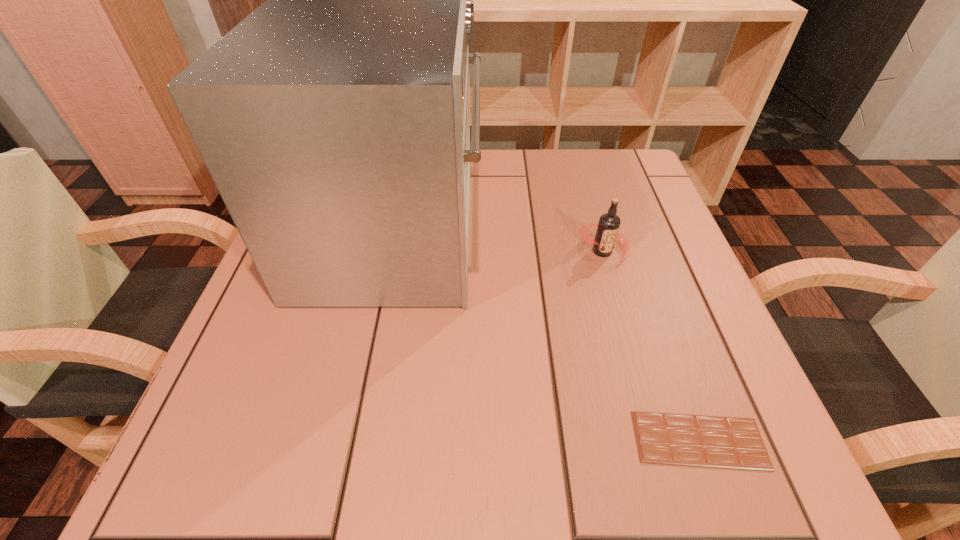
The image size is (960, 540). I want to click on free space between the root beer and the tallest object, so click(x=498, y=243).

Where is `free spot between the nearest object and the toaster oven`? The image size is (960, 540). free spot between the nearest object and the toaster oven is located at coordinates (546, 338).

The height and width of the screenshot is (540, 960). In order to click on vacant space that's between the shortest object and the root beer in this screenshot , I will do `click(651, 346)`.

You are a GUI agent. You are given a task and a screenshot of the screen. Output one action in this format:
    pyautogui.click(x=<x>, y=<y>)
    Task: Click on the empty location between the root beer and the leftmost object
    
    Given the screenshot: What is the action you would take?
    pyautogui.click(x=498, y=243)

Locate an element on the screen. vacant space that is in between the root beer and the nearest object is located at coordinates (651, 346).

In order to click on vacant space in between the tallest object and the second tallest object in this screenshot , I will do [498, 243].

At what (x,y) coordinates should I click in order to perform the action: click on vacant area that lies between the shortest object and the tallest object. Please return your answer as a coordinate pair (x, y). Looking at the image, I should click on (546, 338).

Find the location of a particular element. The height and width of the screenshot is (540, 960). vacant point located between the toaster oven and the second shortest object is located at coordinates (498, 243).

Where is `vacant point located between the nearest object and the tallest object`? vacant point located between the nearest object and the tallest object is located at coordinates (546, 338).

Locate an element on the screen. vacant space in between the root beer and the nearest object is located at coordinates (651, 346).